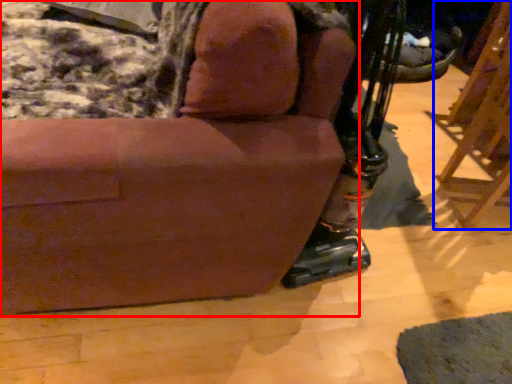
Question: Among these objects, which one is farthest to the camera, chair (highlighted by a red box) or furniture (highlighted by a blue box)?

Choices:
 (A) chair
 (B) furniture

Answer: (B)